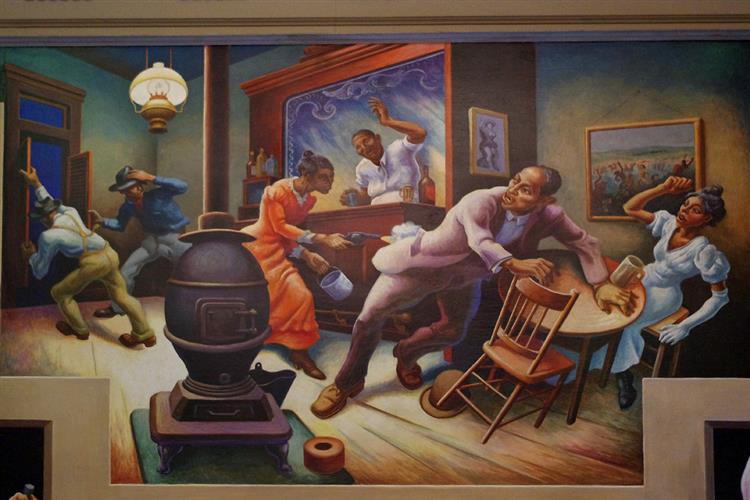
Where is `bar`? bar is located at coordinates (362, 218).